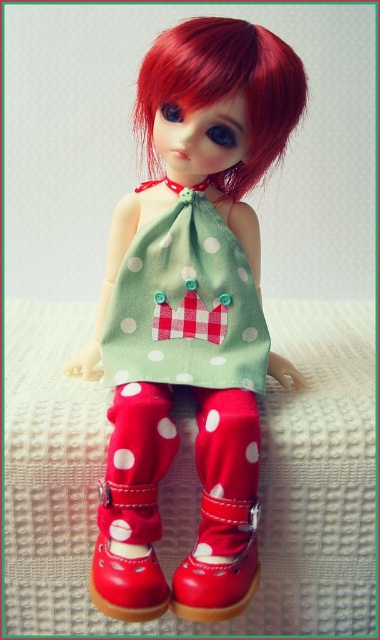
You are a fashion designer trying to decide whether to place the matte green fabric dress at center on the white textured bed at center for a photoshoot. Based on their sizes, will the dress fit on the bed without overlapping the edges?

The matte green fabric dress at center is smaller than the white textured bed at center, so it will fit without overlapping the edges.

You are a photographer setting up a shoot for a doll. You need to ensure the doll is positioned so that the matte green fabric dress at center is visible without being blocked. Given that the white textured bed at center is part of the background, where should you place the doll?

The matte green fabric dress at center is above the white textured bed at center, so placing the doll higher or positioning the bed lower would ensure the dress remains visible and unobstructed by the bed.

You are a photographer setting up a shot of the doll. You need to place a small prop exactly at the position of point (218, 115). If your prop is 2 inches tall, will it be in focus if the depth of field starts at 35 inches?

The distance of point (218, 115) from the camera is 34.57 inches, which is just below the depth of field starting point at 35 inches. Therefore, the prop may not be in focus as it is slightly closer than the depth of field begins.